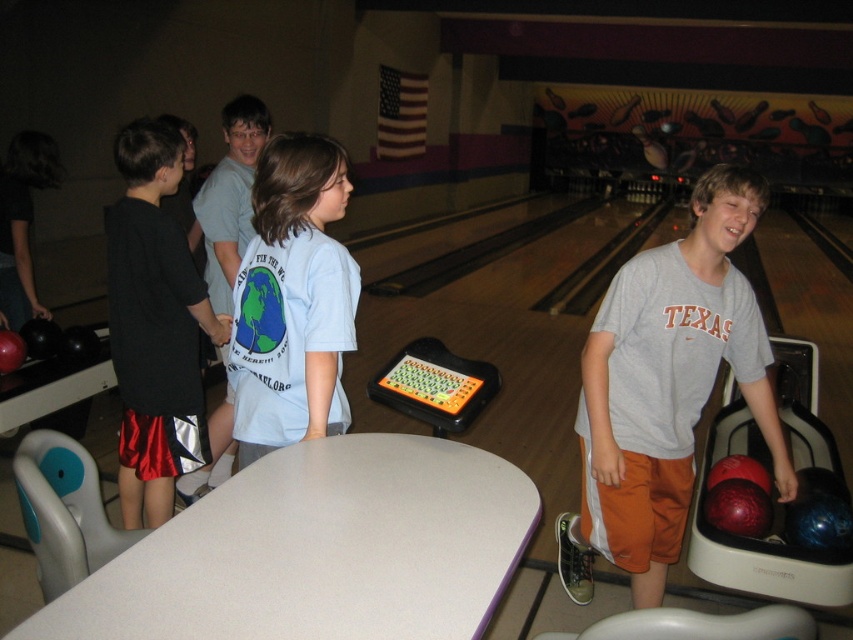
In the image of the children at the bowling alley, where exactly is the black satin shorts at left located?

The black satin shorts at left is located at point (155,324).